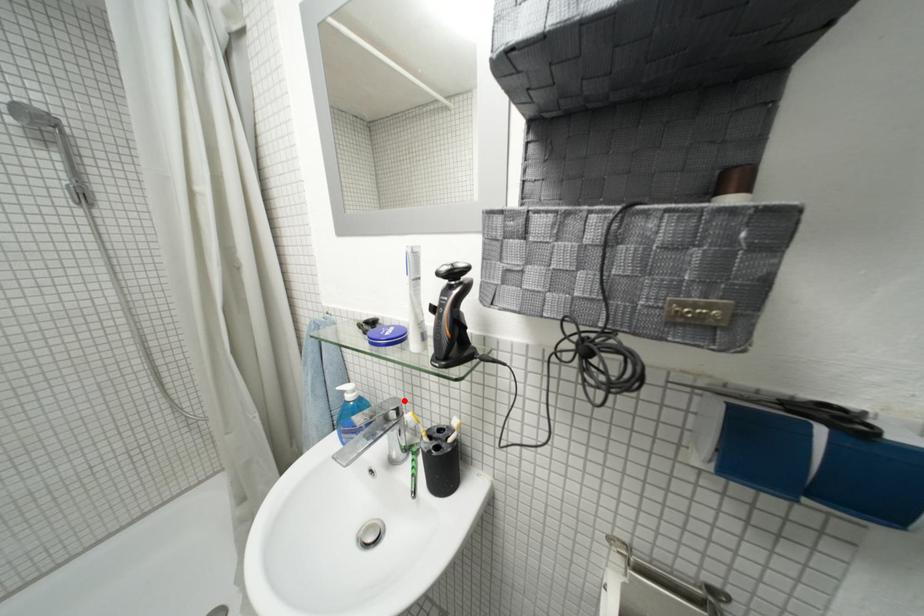
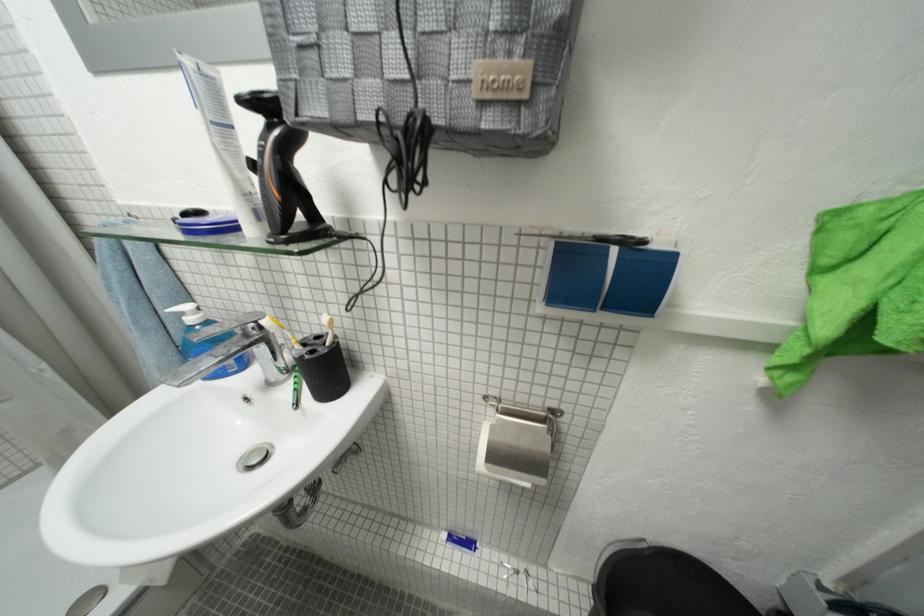
Locate, in the second image, the point that corresponds to the highlighted location in the first image.

(263, 314)